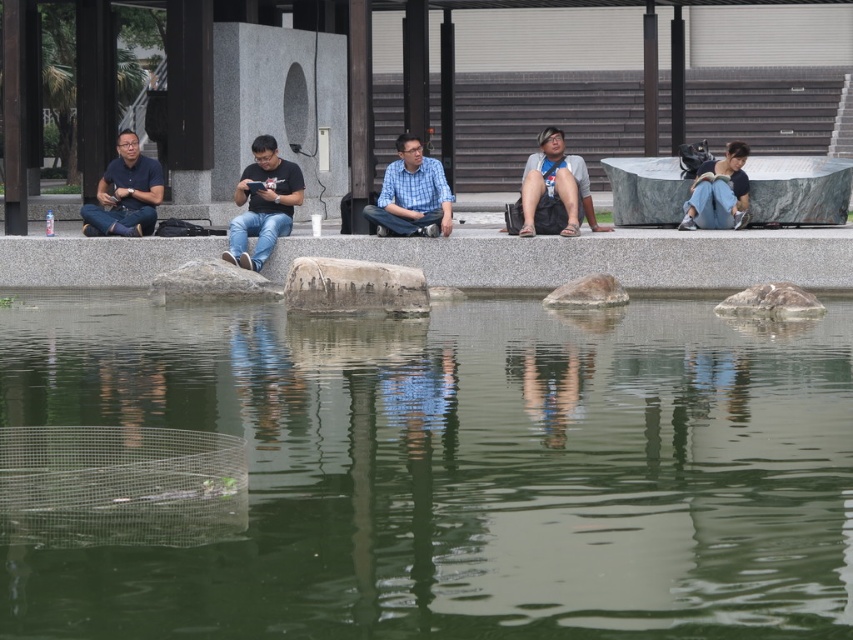
You are planning to place a small potted plant on the gray granite ledge at center and the gray rough stone at center. Which surface can accommodate the plant without it falling off?

The gray rough stone at center can accommodate the plant without it falling off because it is larger than the gray granite ledge at center.

You are a landscape architect evaluating the seating area. Which object, the gray granite ledge at center or the gray rough stone at center, would be more suitable for placing a heavy sculpture without causing damage?

The gray granite ledge at center is much taller than the gray rough stone at center, making it more stable and suitable for placing a heavy sculpture without causing damage.

You are standing at the edge of the water in the image. Looking towards the group of people seated on the gray granite ledge at center, where would the point at coordinates (x=599, y=257) be located relative to your position?

The point at coordinates (x=599, y=257) corresponds to the gray granite ledge at center, which is where the group of people are seated. Since you are at the edge of the water and looking towards them, the point would be directly ahead of you, at the center of the scene.